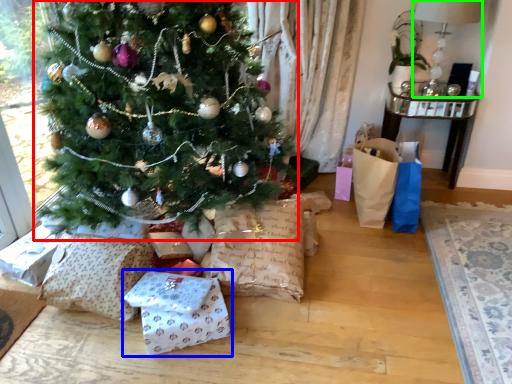
Question: Considering the real-world distances, which object is farthest from christmas tree (highlighted by a red box)? gift wrap (highlighted by a blue box) or lamp (highlighted by a green box)?

Choices:
 (A) gift wrap
 (B) lamp

Answer: (B)